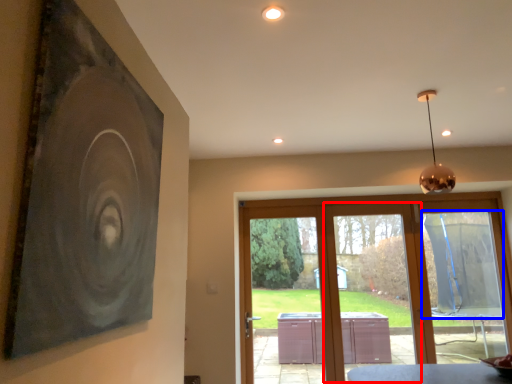
Question: Among these objects, which one is nearest to the camera, screen door (highlighted by a red box) or window screen (highlighted by a blue box)?

Choices:
 (A) screen door
 (B) window screen

Answer: (B)